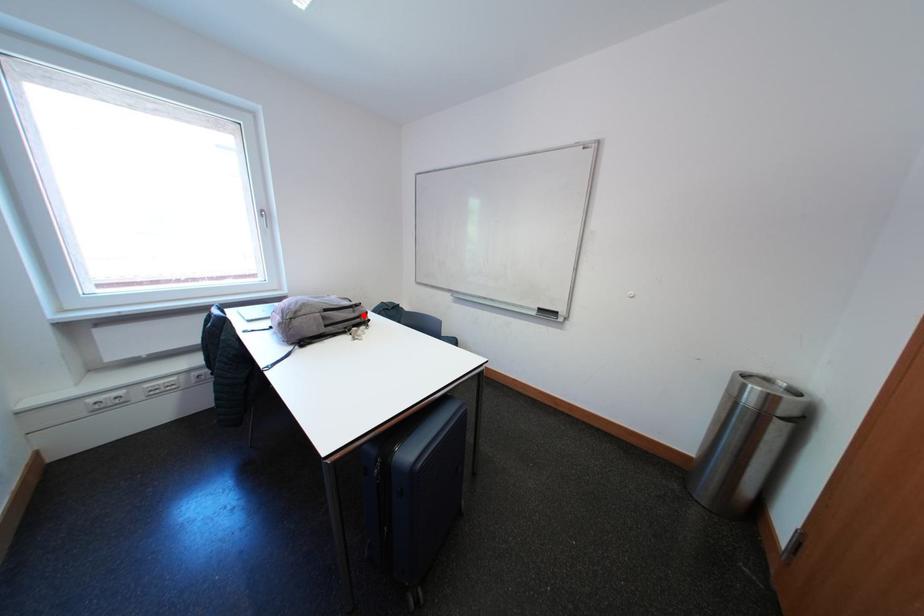
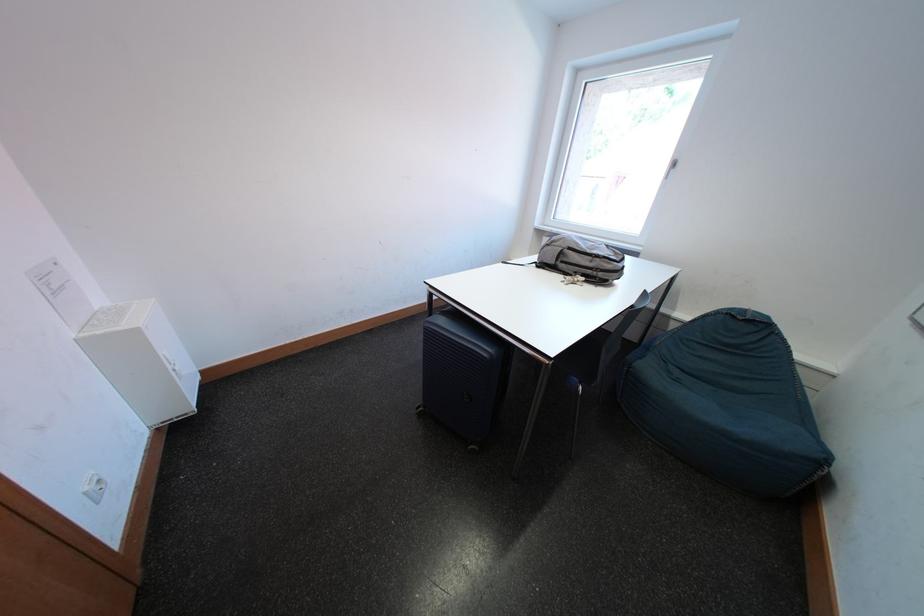
The point at the highlighted location is marked in the first image. Where is the corresponding point in the second image?

(601, 265)